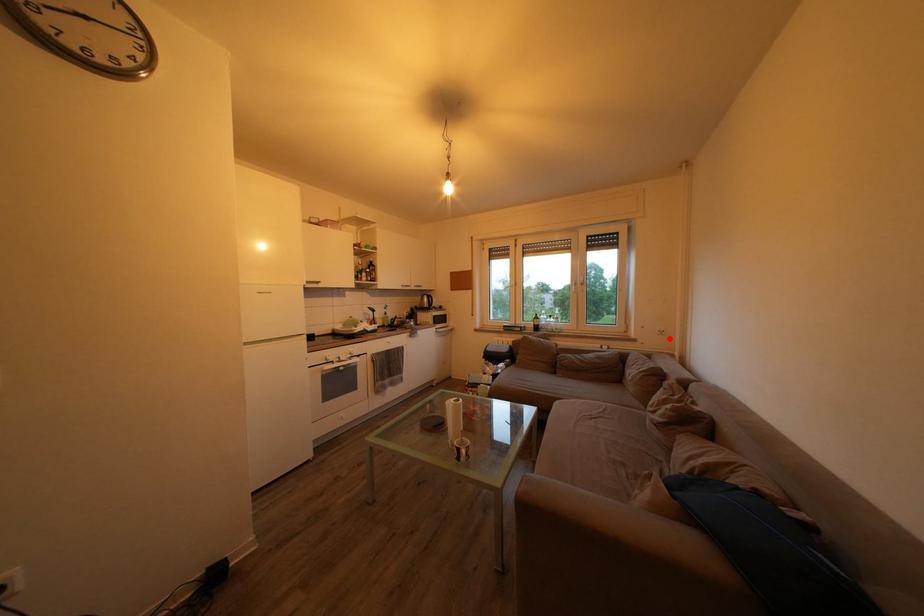
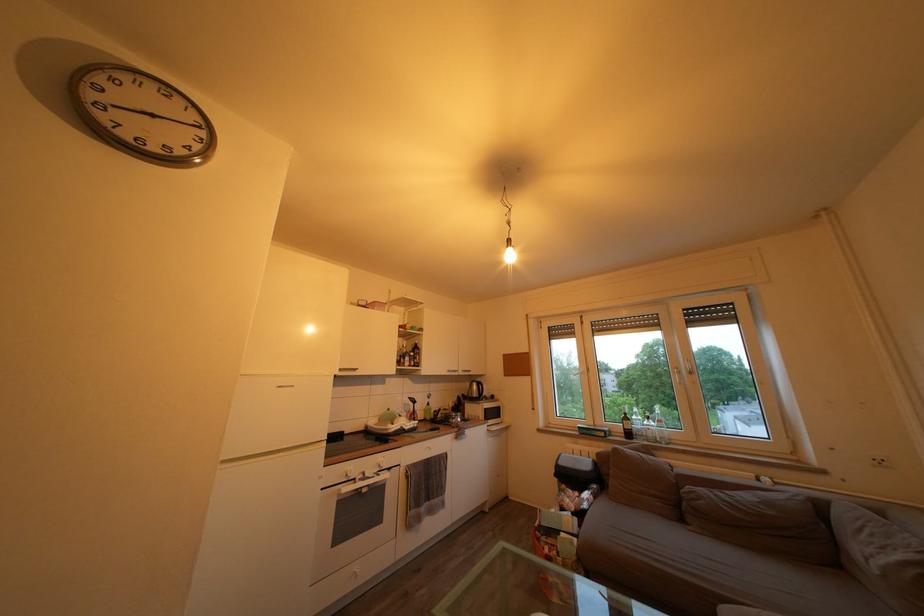
Find the pixel in the second image that matches the highlighted location in the first image.

(889, 468)